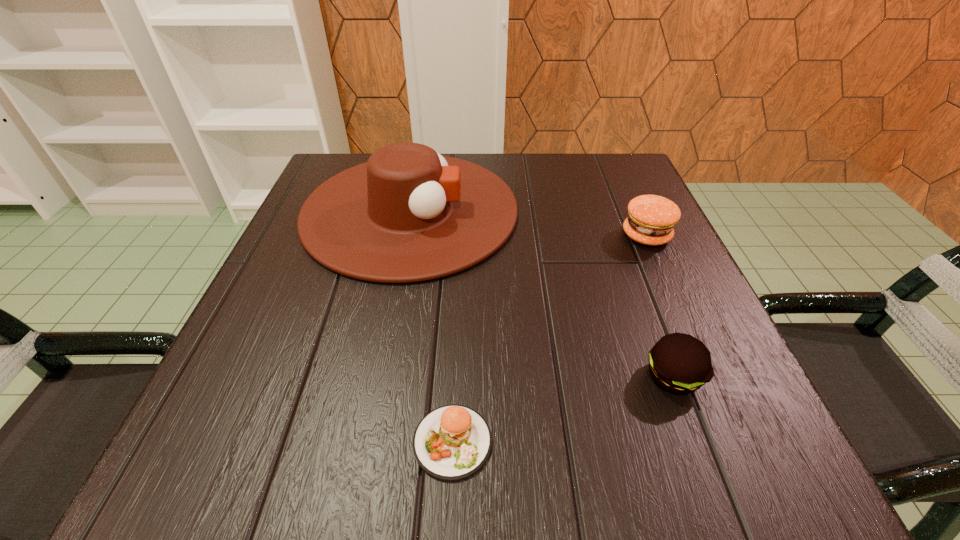
You are a GUI agent. You are given a task and a screenshot of the screen. Output one action in this format:
    pyautogui.click(x=<x>, y=<y>)
    Task: Click on the vacant space that satisfies the following two spatial constraints: 1. on the front-facing side of the second nearest patty; 2. on the right side of the tallest object
    
    Given the screenshot: What is the action you would take?
    pyautogui.click(x=376, y=376)

The width and height of the screenshot is (960, 540). In order to click on free space that satisfies the following two spatial constraints: 1. on the back side of the farthest patty; 2. on the front-facing side of the tallest object in this screenshot , I will do coord(636,211).

You are a GUI agent. You are given a task and a screenshot of the screen. Output one action in this format:
    pyautogui.click(x=<x>, y=<y>)
    Task: Click on the blank area in the image that satisfies the following two spatial constraints: 1. on the back side of the farthest patty; 2. on the front-facing side of the tallest object
    
    Given the screenshot: What is the action you would take?
    pyautogui.click(x=636, y=211)

You are a GUI agent. You are given a task and a screenshot of the screen. Output one action in this format:
    pyautogui.click(x=<x>, y=<y>)
    Task: Click on the free space that satisfies the following two spatial constraints: 1. on the front-facing side of the tallest object; 2. on the right side of the third farthest object
    
    Given the screenshot: What is the action you would take?
    pyautogui.click(x=376, y=376)